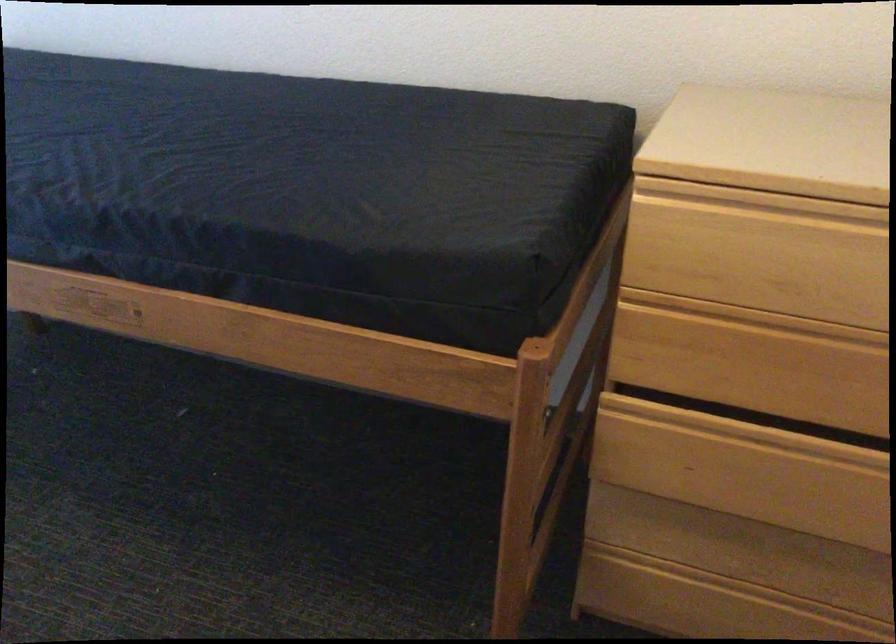
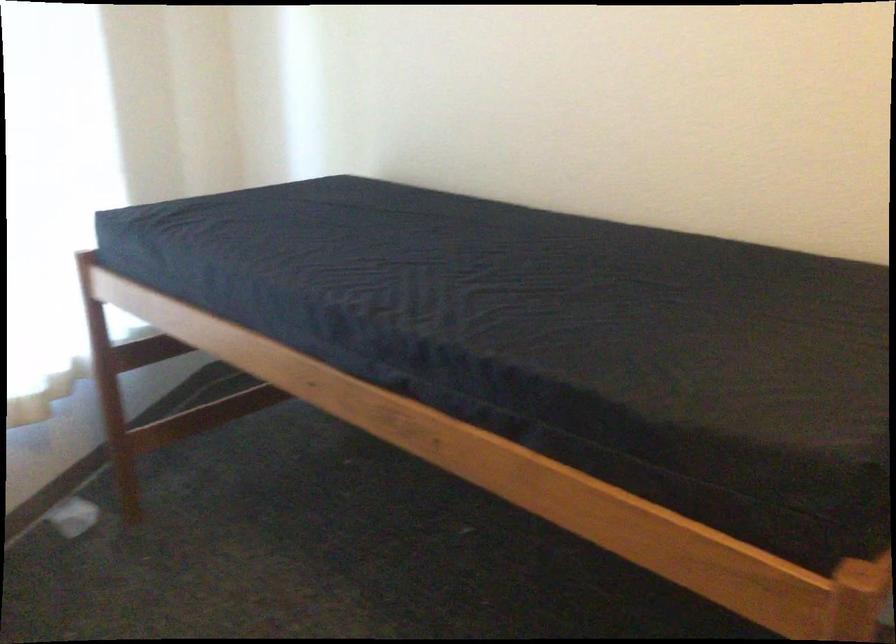
Question: Which direction would the cameraman need to move to produce the second image? Reply with the corresponding letter.

Choices:
 (A) Left
 (B) Right
 (C) Forward
 (D) Backward

Answer: (C)